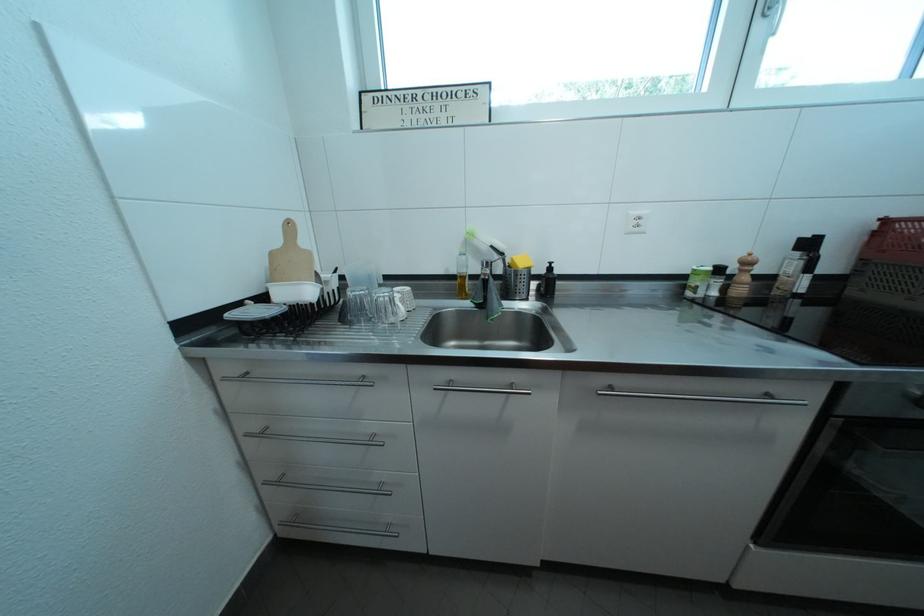
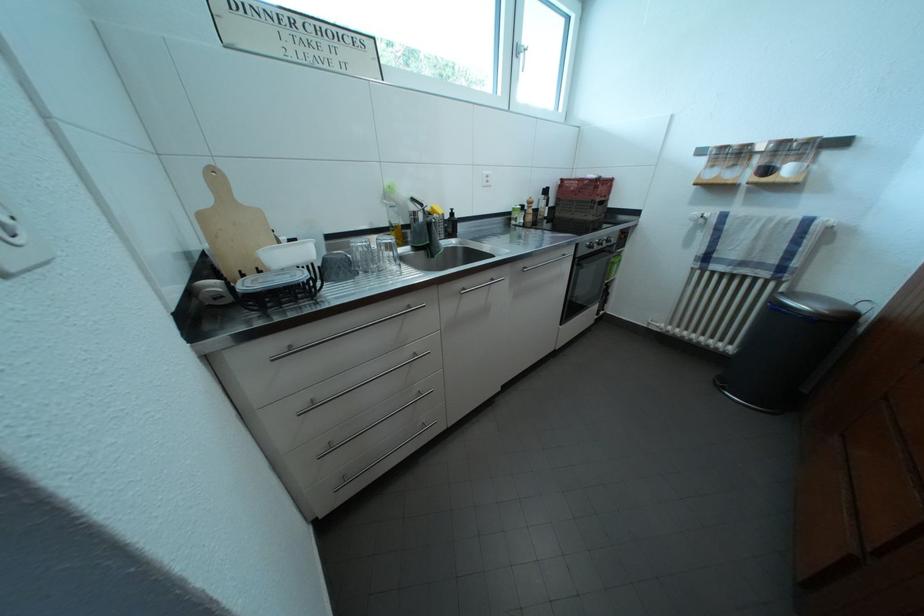
Question: I am providing you with two images of the same scene from different viewpoints. Please identify which objects are invisible in image2.

Choices:
 (A) black oven knob
 (B) clear drinking glass
 (C) silver cabinet handle
 (D) none of these

Answer: (D)